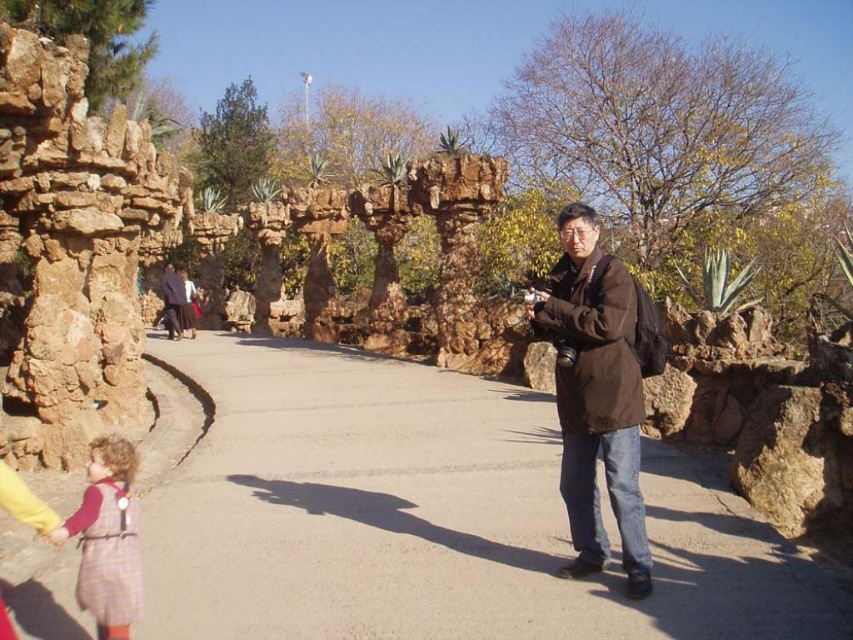
Question: Does concrete pavement at center have a lesser width compared to brown rough stone at left?

Choices:
 (A) no
 (B) yes

Answer: (A)

Question: Estimate the real-world distances between objects in this image. Which object is farther from the brown leather jacket at center?

Choices:
 (A) plaid fabric dress at lower left
 (B) concrete pavement at center

Answer: (A)

Question: Which of the following is the closest to the observer?

Choices:
 (A) (20, 234)
 (B) (581, 504)

Answer: (B)

Question: Is concrete pavement at center closer to camera compared to plaid fabric dress at lower left?

Choices:
 (A) no
 (B) yes

Answer: (A)

Question: Among these objects, which one is farthest from the camera?

Choices:
 (A) brown leather jacket at center
 (B) plaid fabric dress at lower left

Answer: (A)

Question: Does brown rough stone at left appear on the left side of plaid fabric dress at lower left?

Choices:
 (A) yes
 (B) no

Answer: (A)